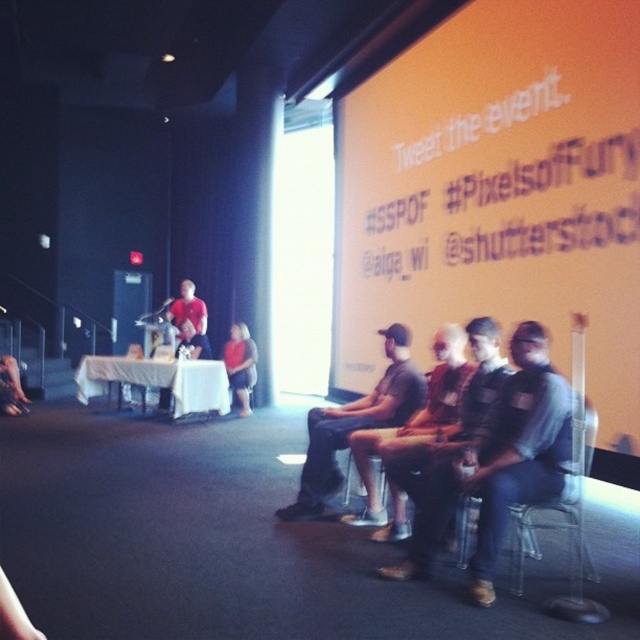
Question: Based on their relative distances, which object is farther from the white cloth-covered table at center?

Choices:
 (A) transparent plastic chair at lower right
 (B) red cotton shirt at center

Answer: (A)

Question: Does dark gray shirt at center have a greater width compared to white cloth-covered table at center?

Choices:
 (A) no
 (B) yes

Answer: (A)

Question: Which of the following is the closest to the observer?

Choices:
 (A) (246, 364)
 (B) (179, 305)
 (C) (576, 403)

Answer: (C)

Question: Among these points, which one is nearest to the camera?

Choices:
 (A) [x=180, y=296]
 (B) [x=384, y=381]
 (C) [x=230, y=385]

Answer: (B)

Question: Does orange matte projection screen at upper center have a smaller size compared to dark gray shirt at center?

Choices:
 (A) no
 (B) yes

Answer: (A)

Question: Can you confirm if dark gray shirt at center is positioned to the left of red cotton shirt at center?

Choices:
 (A) no
 (B) yes

Answer: (A)